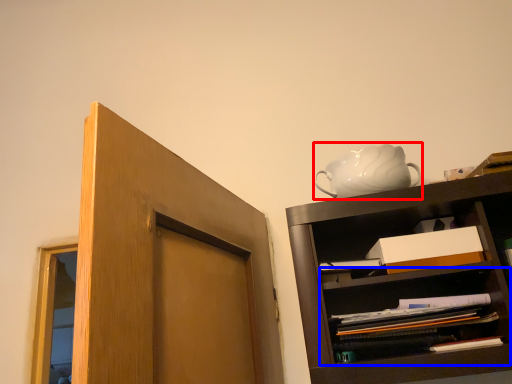
Question: Among these objects, which one is farthest to the camera, tea pot (highlighted by a red box) or shelf (highlighted by a blue box)?

Choices:
 (A) tea pot
 (B) shelf

Answer: (A)